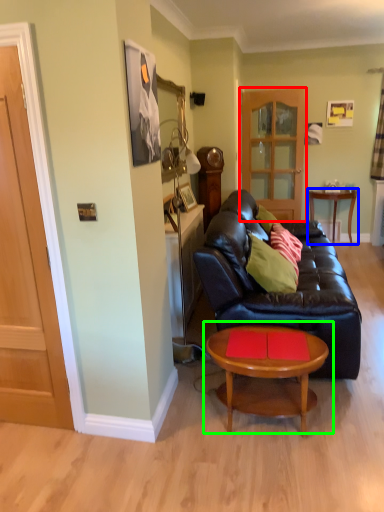
Question: Which object is the closest to the glass door (highlighted by a red box)? Choose among these: table (highlighted by a blue box) or coffee table (highlighted by a green box).

Choices:
 (A) table
 (B) coffee table

Answer: (A)